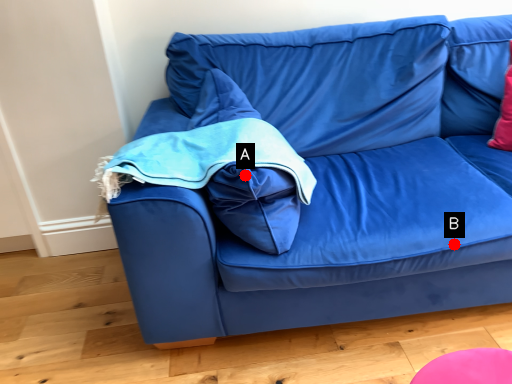
Question: Two points are circled on the image, labeled by A and B beside each circle. Which point is further to the camera?

Choices:
 (A) A is further
 (B) B is further

Answer: (B)